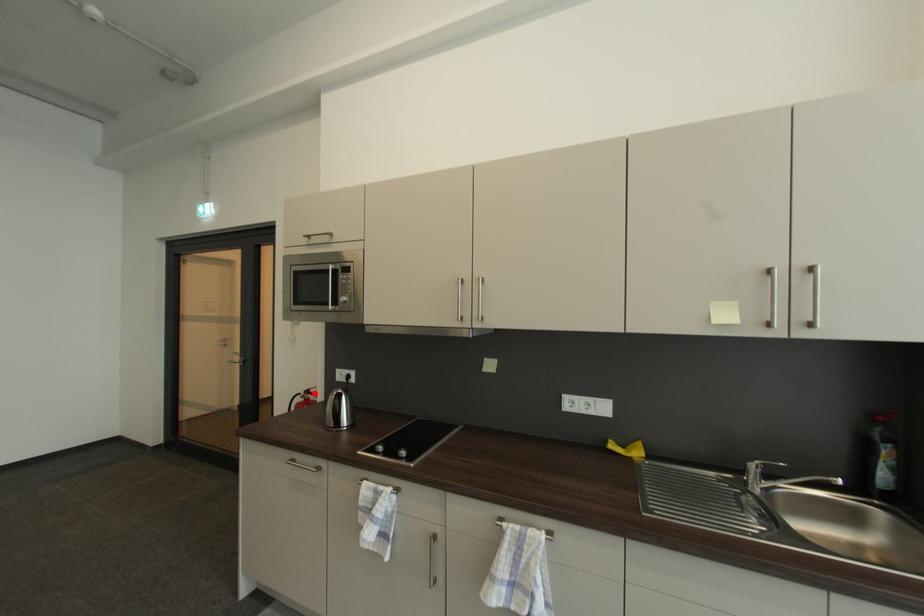
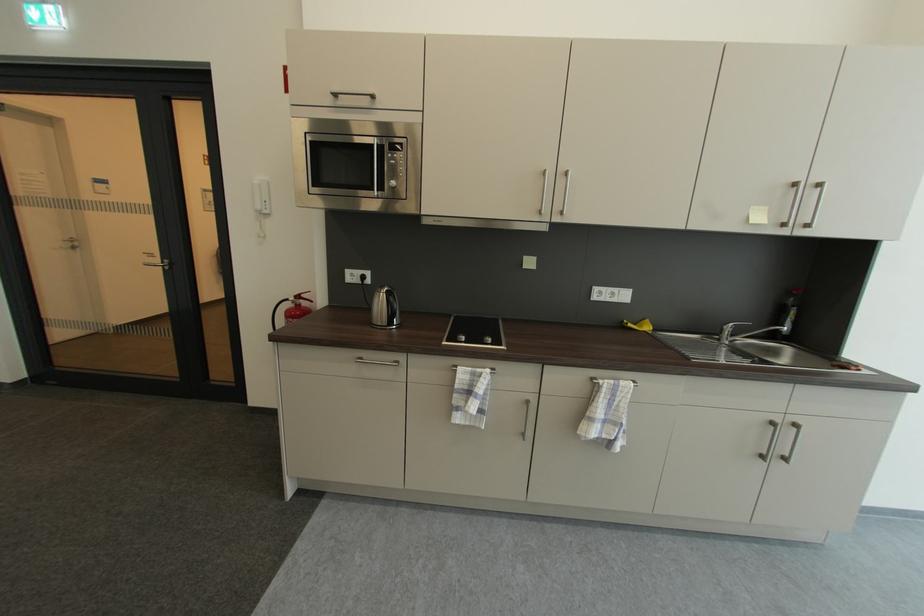
Question: I am providing you with two images of the same scene from different viewpoints. In image1, a red point is highlighted. Considering the same 3D point in image2, which of the following is correct?

Choices:
 (A) It is closer
 (B) It is farther

Answer: (A)